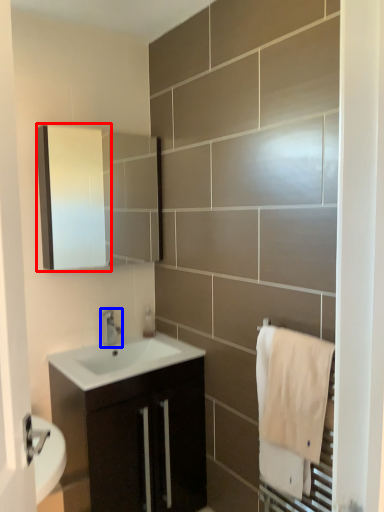
Question: Which object appears closest to the camera in this image, medicine cabinet (highlighted by a red box) or tap (highlighted by a blue box)?

Choices:
 (A) medicine cabinet
 (B) tap

Answer: (A)